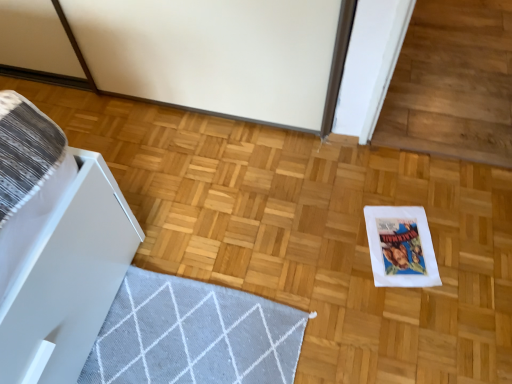
Image resolution: width=512 pixels, height=384 pixels. What are the coordinates of `vacant area that lies to the right of matte white comic book at lower right` in the screenshot? It's located at (462, 244).